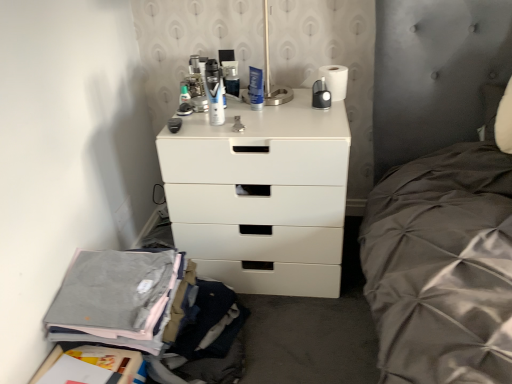
This screenshot has height=384, width=512. Find the location of `free space in front of translucent plastic toothbrush at upper center, the first toiletry positioned from the left`. free space in front of translucent plastic toothbrush at upper center, the first toiletry positioned from the left is located at coordinates (196, 123).